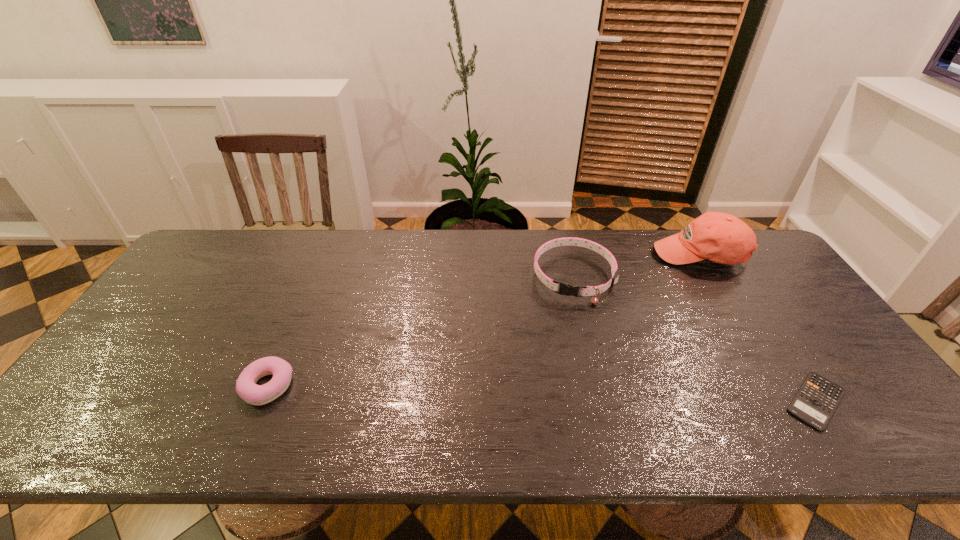
Locate an element on the screen. Image resolution: width=960 pixels, height=540 pixels. free space on the desktop that is between the third tallest object and the calculator and is positioned on the front-facing side of the tallest object is located at coordinates (618, 395).

Identify the location of vacant space on the desktop that is between the leftmost object and the calculator and is positioned with the buckle on the second tallest object. Image resolution: width=960 pixels, height=540 pixels. (552, 394).